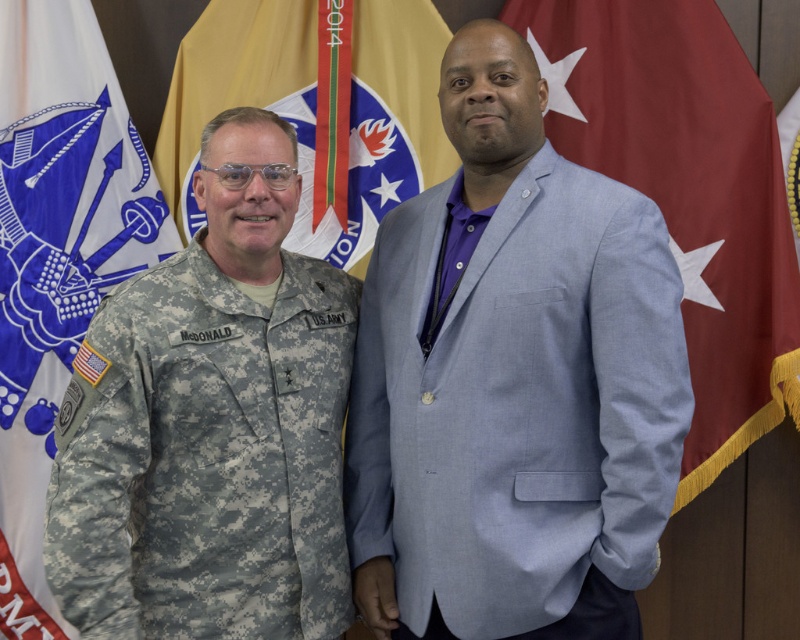
Who is higher up, light blue fabric blazer at right or white fabric flag at left?

white fabric flag at left is above.

Who is more forward, (578, 376) or (117, 179)?

Positioned in front is point (578, 376).

Image resolution: width=800 pixels, height=640 pixels. What do you see at coordinates (517, 403) in the screenshot?
I see `light blue fabric blazer at right` at bounding box center [517, 403].

The width and height of the screenshot is (800, 640). In order to click on light blue fabric blazer at right in this screenshot , I will do tap(517, 403).

Based on the photo, does camouflage fabric uniform at left appear over white fabric flag at left?

No, camouflage fabric uniform at left is not above white fabric flag at left.

Between point (212, 291) and point (92, 112), which one is positioned in front?

Point (212, 291) is in front.

The height and width of the screenshot is (640, 800). Find the location of `camouflage fabric uniform at left`. camouflage fabric uniform at left is located at coordinates (206, 458).

Does red fabric flag at right appear on the left side of gold textured flag at center?

No, red fabric flag at right is not to the left of gold textured flag at center.

Is red fabric flag at right closer to the viewer compared to gold textured flag at center?

That is True.

Is point (736, 198) farther from viewer compared to point (329, 19)?

No, (736, 198) is in front of (329, 19).

Where is `red fabric flag at right`? red fabric flag at right is located at coordinates (688, 192).